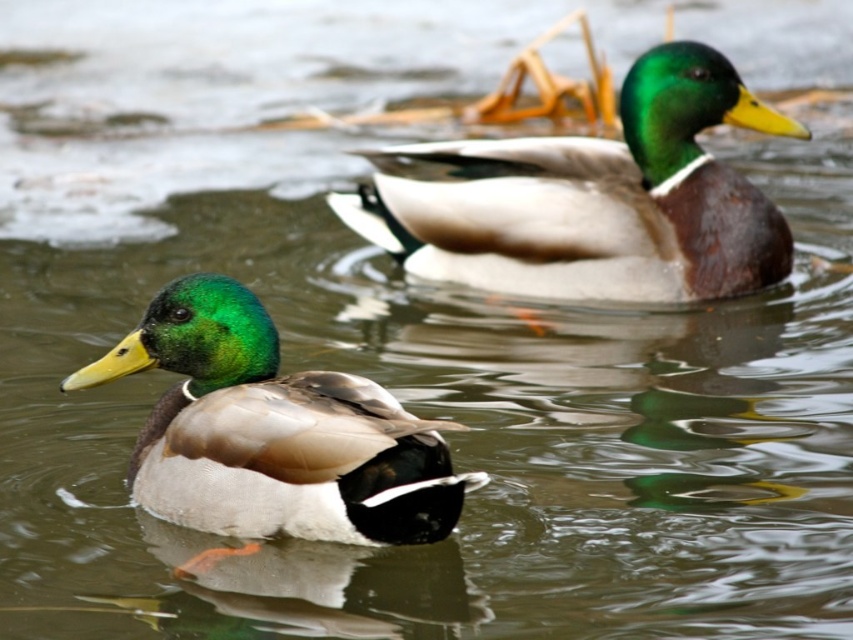
You are a wildlife photographer aiming to capture the shiny brown duck at upper center and the shiny green duck at center in a single frame. Given their widths, which duck would require more space horizontally in your photo to fully capture its entire body?

The shiny brown duck at upper center requires more horizontal space in the photo because its width surpasses that of the shiny green duck at center.

You are a photographer trying to capture both the shiny brown duck at upper center and the shiny green duck at center in a single shot. Which duck should you focus on to ensure the other remains in the background?

You should focus on the shiny brown duck at upper center because it is closer to you than the shiny green duck at center, which will naturally stay in the background due to the depth of field.

You are observing two ducks in the water. The shiny brown duck at upper center and the shiny green duck at center. Which duck is located to the right of the other?

The shiny brown duck at upper center is positioned to the right of the shiny green duck at center.